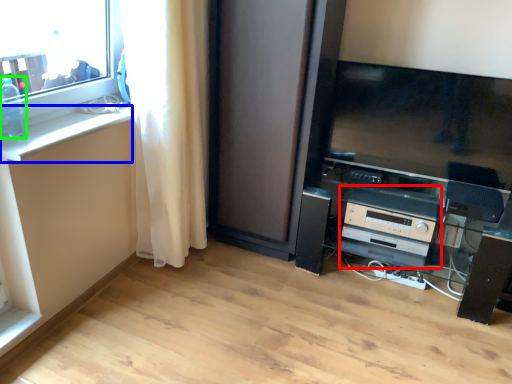
Question: Which object is positioned farthest from appliance (highlighted by a red box)? Select from counter top (highlighted by a blue box) and bottle (highlighted by a green box).

Choices:
 (A) counter top
 (B) bottle

Answer: (B)